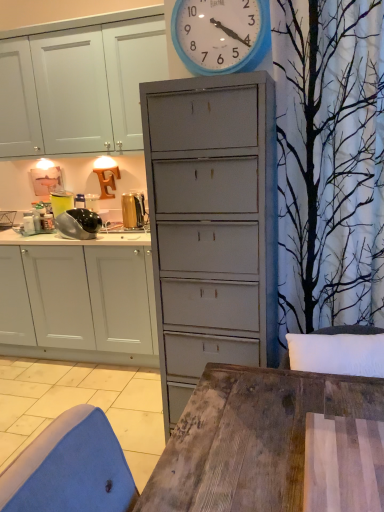
Question: Considering the positions of point (41, 264) and point (190, 50), is point (41, 264) closer or farther from the camera than point (190, 50)?

Choices:
 (A) farther
 (B) closer

Answer: (A)

Question: Is white matte cabinet at left in front of or behind blue plastic wall clock at upper center in the image?

Choices:
 (A) behind
 (B) front

Answer: (A)

Question: Which of these objects is positioned farthest from the gold metallic toaster at upper left, which is counted as the first appliance, starting from the right?

Choices:
 (A) shiny metallic food processor at left, which appears as the second appliance when viewed from the right
 (B) blue plastic wall clock at upper center
 (C) white matte cabinet at left

Answer: (B)

Question: Which of these objects is positioned closest to the gold metallic toaster at upper left, acting as the 2th appliance starting from the left?

Choices:
 (A) shiny metallic food processor at left, the first appliance when ordered from left to right
 (B) white matte cabinet at left
 (C) blue plastic wall clock at upper center

Answer: (A)